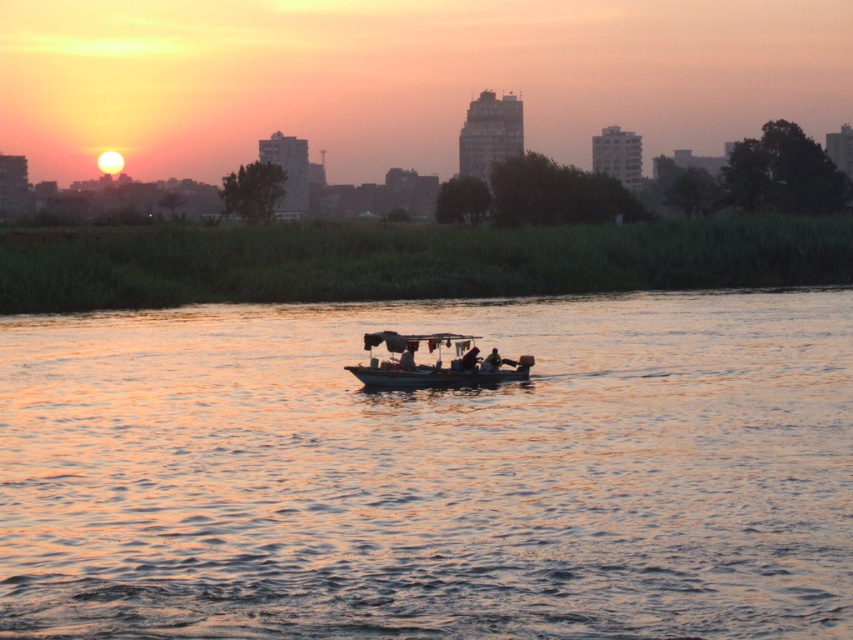
Question: Does smooth water at center have a lesser width compared to metallic gray boat at center?

Choices:
 (A) no
 (B) yes

Answer: (A)

Question: Is smooth water at center smaller than metallic gray boat at center?

Choices:
 (A) yes
 (B) no

Answer: (B)

Question: Considering the relative positions of smooth water at center and metallic gray boat at center in the image provided, where is smooth water at center located with respect to metallic gray boat at center?

Choices:
 (A) below
 (B) above

Answer: (B)